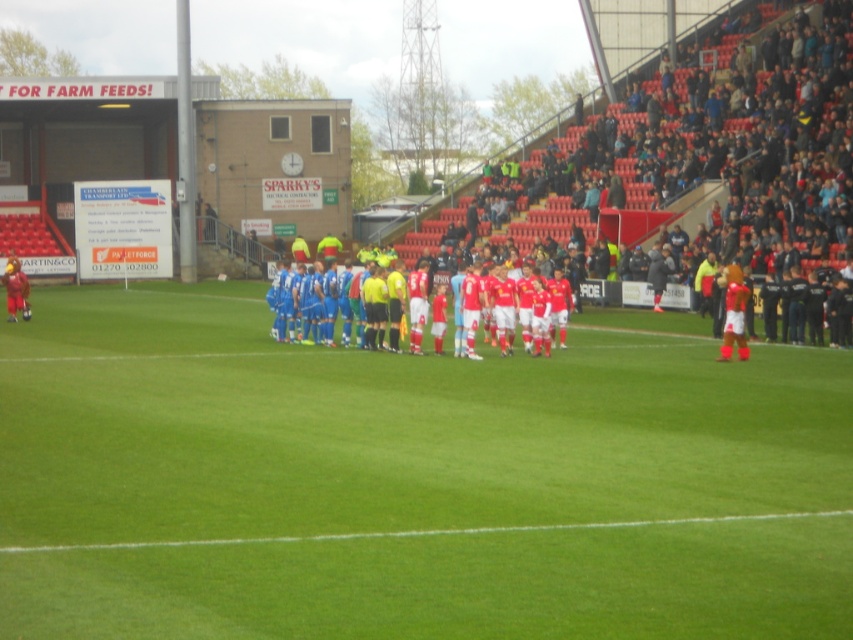
Does green grass field at center appear under blue fabric jersey at center?

Indeed, green grass field at center is positioned under blue fabric jersey at center.

Locate an element on the screen. This screenshot has width=853, height=640. green grass field at center is located at coordinates (410, 481).

I want to click on green grass field at center, so click(x=410, y=481).